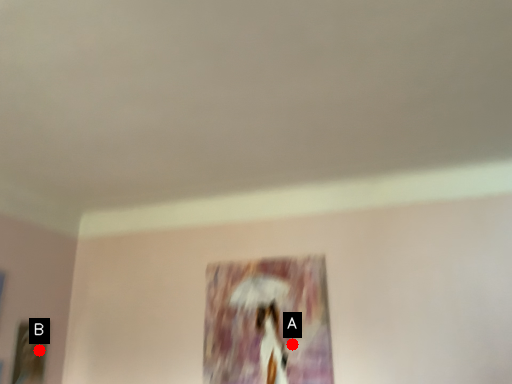
Question: Two points are circled on the image, labeled by A and B beside each circle. Which of the following is the farthest from the observer?

Choices:
 (A) A is further
 (B) B is further

Answer: (B)